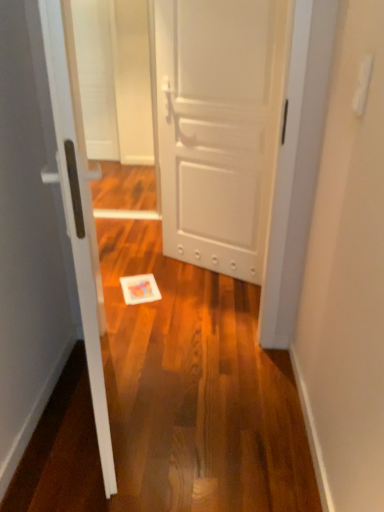
What do you see at coordinates (219, 127) in the screenshot?
I see `white matte door at center, which appears as the 1th door when viewed from the right` at bounding box center [219, 127].

Identify the location of white matte door at center, the 2th door in the left-to-right sequence. (x=219, y=127).

Measure the distance between point (x=222, y=203) and camera.

Point (x=222, y=203) and camera are 2.60 meters apart from each other.

What do you see at coordinates (44, 229) in the screenshot? I see `white glossy door at center, acting as the second door starting from the right` at bounding box center [44, 229].

At what (x,y) coordinates should I click in order to perform the action: click on white glossy door at center, the second door from the back. Please return your answer as a coordinate pair (x, y). The height and width of the screenshot is (512, 384). Looking at the image, I should click on (44, 229).

At what (x,y) coordinates should I click in order to perform the action: click on white matte door at center, positioned as the 1th door in back-to-front order. Please return your answer as a coordinate pair (x, y). This screenshot has height=512, width=384. Looking at the image, I should click on point(219,127).

Considering the positions of objects white glossy door at center, the second door from the back, and white matte door at center, which appears as the 1th door when viewed from the right, in the image provided, who is more to the left, white glossy door at center, the second door from the back, or white matte door at center, which appears as the 1th door when viewed from the right,?

From the viewer's perspective, white glossy door at center, the second door from the back, appears more on the left side.

Is white glossy door at center, acting as the second door starting from the right, positioned behind white matte door at center, which appears as the second door when viewed from the front?

No, white glossy door at center, acting as the second door starting from the right, is closer to the camera.

Is point (42, 50) positioned in front of point (201, 75)?

Yes, point (42, 50) is in front of point (201, 75).

From the image's perspective, is white glossy door at center, marked as the 1th door in a front-to-back arrangement, above white matte door at center, which appears as the 1th door when viewed from the right?

No, from the image's perspective, white glossy door at center, marked as the 1th door in a front-to-back arrangement, is not above white matte door at center, which appears as the 1th door when viewed from the right.

From a real-world perspective, is white glossy door at center, acting as the second door starting from the right, positioned above or below white matte door at center, which appears as the second door when viewed from the front?

In terms of real-world spatial position, white glossy door at center, acting as the second door starting from the right, is below white matte door at center, which appears as the second door when viewed from the front.

Which of these two, white glossy door at center, the second door from the back, or white matte door at center, which appears as the 1th door when viewed from the right, is wider?

Wider between the two is white glossy door at center, the second door from the back.

Is white glossy door at center, acting as the second door starting from the right, taller than white matte door at center, the 2th door in the left-to-right sequence?

No, white glossy door at center, acting as the second door starting from the right, is not taller than white matte door at center, the 2th door in the left-to-right sequence.

Based on the photo, is white glossy door at center, the first door viewed from the left, bigger or smaller than white matte door at center, which appears as the 1th door when viewed from the right?

In the image, white glossy door at center, the first door viewed from the left, appears to be larger than white matte door at center, which appears as the 1th door when viewed from the right.

Is white glossy door at center, the second door from the back, not inside white matte door at center, which appears as the second door when viewed from the front?

Absolutely, white glossy door at center, the second door from the back, is external to white matte door at center, which appears as the second door when viewed from the front.

Are white glossy door at center, the first door viewed from the left, and white matte door at center, the 2th door in the left-to-right sequence, located far from each other?

Yes, white glossy door at center, the first door viewed from the left, is far from white matte door at center, the 2th door in the left-to-right sequence.

In the scene shown: Is white glossy door at center, acting as the second door starting from the right, oriented away from white matte door at center, which appears as the 1th door when viewed from the right?

white glossy door at center, acting as the second door starting from the right, is not turned away from white matte door at center, which appears as the 1th door when viewed from the right.

Can you tell me how much white glossy door at center, marked as the 1th door in a front-to-back arrangement, and white matte door at center, which appears as the second door when viewed from the front, differ in facing direction?

129 degrees separate the facing orientations of white glossy door at center, marked as the 1th door in a front-to-back arrangement, and white matte door at center, which appears as the second door when viewed from the front.

Identify the location of door lying below the white matte door at center, which appears as the second door when viewed from the front (from the image's perspective). (44, 229).

Between white matte door at center, positioned as the 1th door in back-to-front order, and white glossy door at center, acting as the second door starting from the right, which one appears on the right side from the viewer's perspective?

white matte door at center, positioned as the 1th door in back-to-front order, is more to the right.

Who is more distant, white matte door at center, positioned as the 1th door in back-to-front order, or white glossy door at center, the first door viewed from the left?

white matte door at center, positioned as the 1th door in back-to-front order, is further from the camera.

Is point (263, 42) positioned in front of point (26, 207)?

No, (263, 42) is behind (26, 207).

From the image's perspective, which object appears higher, white matte door at center, positioned as the 1th door in back-to-front order, or white glossy door at center, marked as the 1th door in a front-to-back arrangement?

white matte door at center, positioned as the 1th door in back-to-front order, appears higher in the image.

From a real-world perspective, which object rests below the other?

white glossy door at center, marked as the 1th door in a front-to-back arrangement, is physically lower.

Which of these two, white matte door at center, the 2th door in the left-to-right sequence, or white glossy door at center, the second door from the back, is thinner?

white matte door at center, the 2th door in the left-to-right sequence.

Is white matte door at center, which appears as the second door when viewed from the front, taller or shorter than white glossy door at center, the second door from the back?

In the image, white matte door at center, which appears as the second door when viewed from the front, appears to be taller than white glossy door at center, the second door from the back.

Considering the relative sizes of white matte door at center, positioned as the 1th door in back-to-front order, and white glossy door at center, the first door viewed from the left, in the image provided, is white matte door at center, positioned as the 1th door in back-to-front order, bigger than white glossy door at center, the first door viewed from the left,?

No.

Could white glossy door at center, the second door from the back, be considered to be inside white matte door at center, which appears as the 1th door when viewed from the right?

Actually, white glossy door at center, the second door from the back, is outside white matte door at center, which appears as the 1th door when viewed from the right.

Are white matte door at center, which appears as the 1th door when viewed from the right, and white glossy door at center, marked as the 1th door in a front-to-back arrangement, located far from each other?

Yes, white matte door at center, which appears as the 1th door when viewed from the right, and white glossy door at center, marked as the 1th door in a front-to-back arrangement, are located far from each other.

Does white matte door at center, which appears as the 1th door when viewed from the right, turn towards white glossy door at center, the second door from the back?

Yes, white matte door at center, which appears as the 1th door when viewed from the right, is oriented towards white glossy door at center, the second door from the back.

Can you tell me how much white matte door at center, positioned as the 1th door in back-to-front order, and white glossy door at center, the first door viewed from the left, differ in facing direction?

The angle between the facing direction of white matte door at center, positioned as the 1th door in back-to-front order, and the facing direction of white glossy door at center, the first door viewed from the left, is 129 degrees.

Where is `door that is behind the white glossy door at center, the first door viewed from the left`? door that is behind the white glossy door at center, the first door viewed from the left is located at coordinates (219, 127).

Where is `door located on the left of white matte door at center, the 2th door in the left-to-right sequence`? door located on the left of white matte door at center, the 2th door in the left-to-right sequence is located at coordinates (44, 229).

Where is `door that is above the white glossy door at center, the first door viewed from the left (from a real-world perspective)`? The image size is (384, 512). door that is above the white glossy door at center, the first door viewed from the left (from a real-world perspective) is located at coordinates (219, 127).